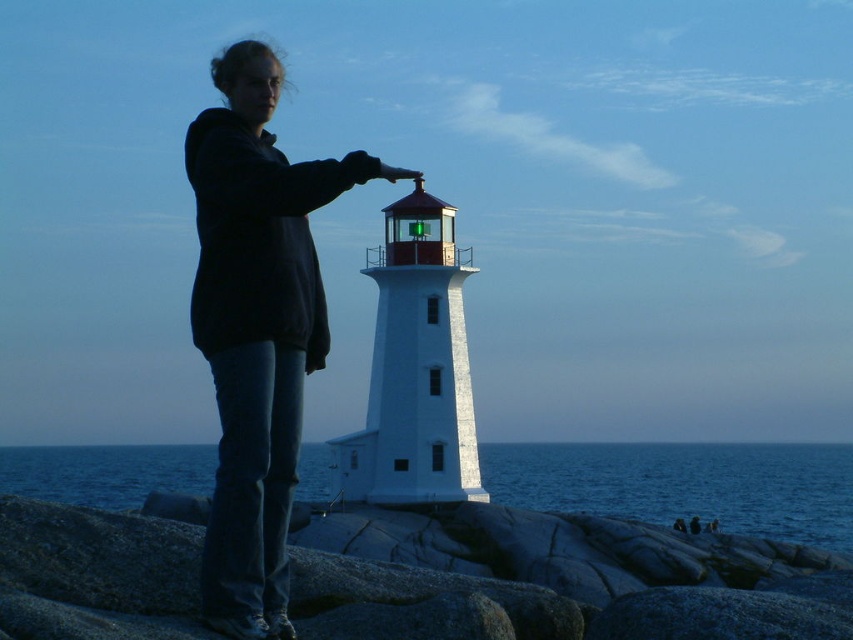
Question: Can you confirm if dark blue hoodie at center is positioned above blue water at lower center?

Choices:
 (A) no
 (B) yes

Answer: (B)

Question: Can you confirm if granite rocks at center is positioned below dark blue hoodie at center?

Choices:
 (A) no
 (B) yes

Answer: (B)

Question: Which of the following is the closest to the observer?

Choices:
 (A) blue water at lower center
 (B) dark blue hoodie at center
 (C) granite rocks at center

Answer: (C)

Question: Which of these objects is positioned farthest from the granite rocks at center?

Choices:
 (A) blue water at lower center
 (B) dark blue hoodie at center

Answer: (A)

Question: Can you confirm if granite rocks at center is positioned to the right of blue water at lower center?

Choices:
 (A) no
 (B) yes

Answer: (B)

Question: Which point is farther to the camera?

Choices:
 (A) (202, 602)
 (B) (303, 474)
 (C) (294, 600)

Answer: (B)